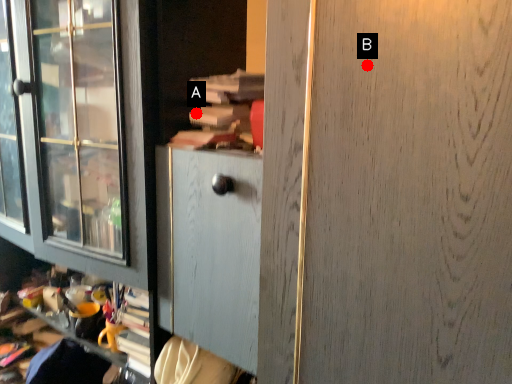
Question: Two points are circled on the image, labeled by A and B beside each circle. Among these points, which one is farthest from the camera?

Choices:
 (A) A is further
 (B) B is further

Answer: (A)